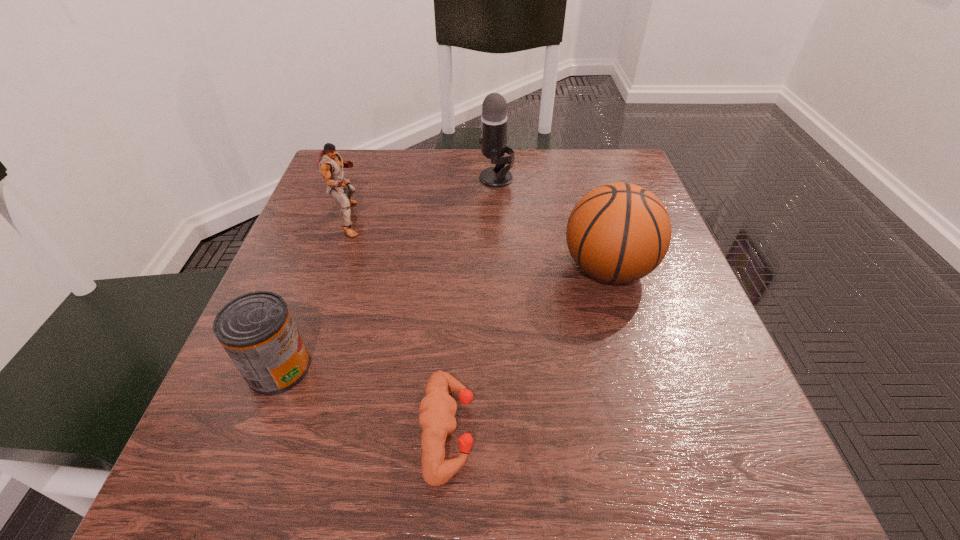
Where is `vacant space that is in between the shorter puncher and the left puncher`? vacant space that is in between the shorter puncher and the left puncher is located at coordinates (398, 325).

Where is `empty location between the right puncher and the farther puncher`? The width and height of the screenshot is (960, 540). empty location between the right puncher and the farther puncher is located at coordinates (398, 325).

Where is `vacant space in between the basketball and the microphone`? The width and height of the screenshot is (960, 540). vacant space in between the basketball and the microphone is located at coordinates (552, 224).

Find the location of a particular element. The height and width of the screenshot is (540, 960). vacant area between the farther puncher and the third object from right to left is located at coordinates (398, 325).

Where is `empty space between the second object from right to left and the shorter puncher`? Image resolution: width=960 pixels, height=540 pixels. empty space between the second object from right to left and the shorter puncher is located at coordinates (472, 305).

Choose which object is the nearest neighbor to the can. Please provide its 2D coordinates. Your answer should be formatted as a tuple, i.e. [(x, y)], where the tuple contains the x and y coordinates of a point satisfying the conditions above.

[(438, 409)]

At what (x,y) coordinates should I click in order to perform the action: click on object that is the nearest to the taller puncher. Please return your answer as a coordinate pair (x, y). This screenshot has width=960, height=540. Looking at the image, I should click on (494, 118).

Locate an element on the screen. Image resolution: width=960 pixels, height=540 pixels. vacant space that satisfies the following two spatial constraints: 1. on the back side of the basketball; 2. on the front-facing side of the farther puncher is located at coordinates (593, 219).

Where is `free space in the image that satisfies the following two spatial constraints: 1. on the front side of the basketball; 2. with the gloves of the right puncher facing forward`? free space in the image that satisfies the following two spatial constraints: 1. on the front side of the basketball; 2. with the gloves of the right puncher facing forward is located at coordinates (656, 430).